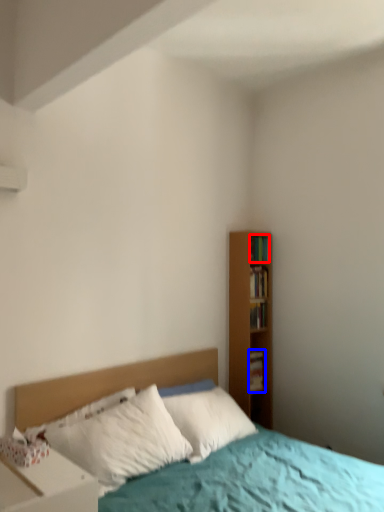
Question: Among these objects, which one is nearest to the camera, book (highlighted by a red box) or book (highlighted by a blue box)?

Choices:
 (A) book
 (B) book

Answer: (A)